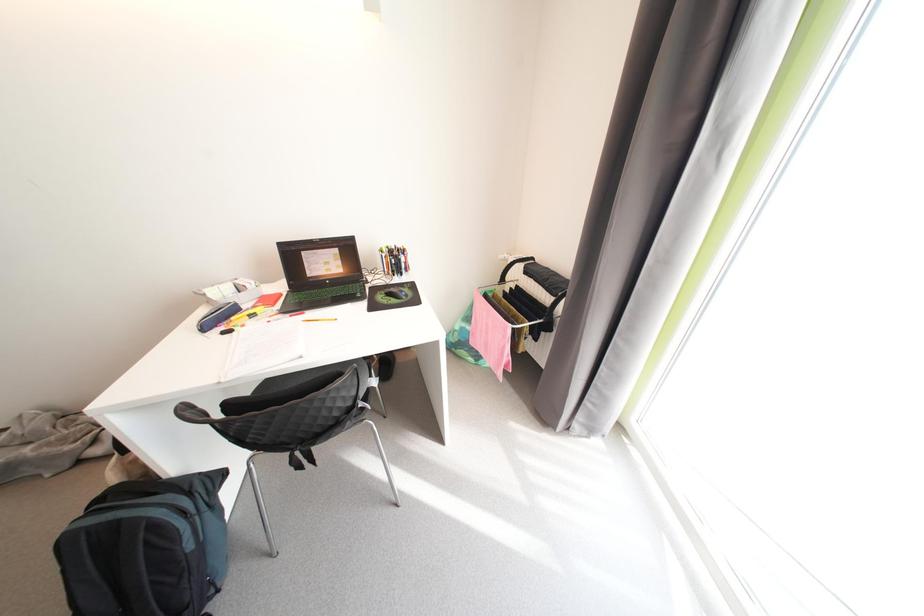
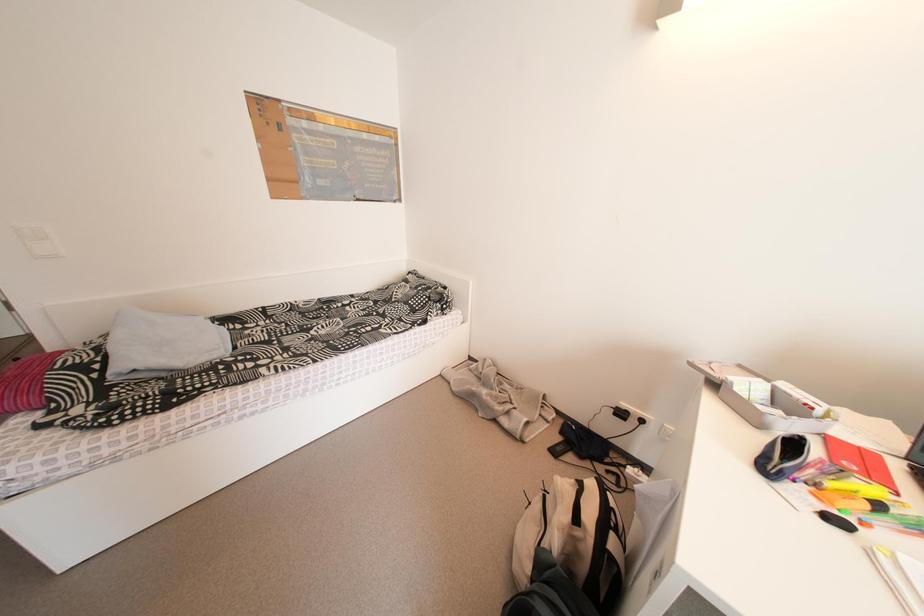
Question: The first image is from the beginning of the video and the second image is from the end. How did the camera likely rotate when shooting the video?

Choices:
 (A) Left
 (B) Right
 (C) Up
 (D) Down

Answer: (A)